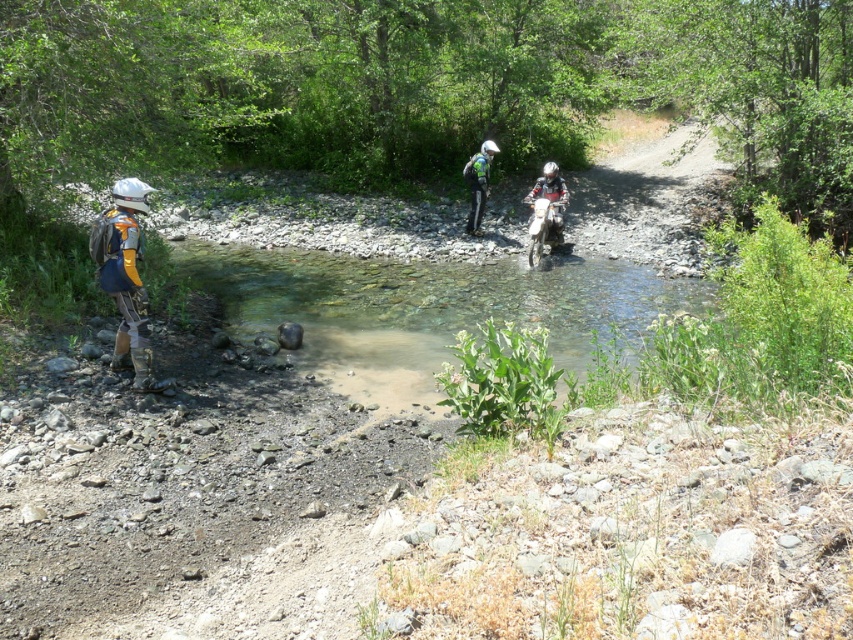
Question: Based on their relative distances, which object is farther from the clear water at center?

Choices:
 (A) matte silver helmet at left
 (B) white matte dirt bike at center
 (C) white matte motorcycle at center
 (D) green matte helmet at center

Answer: (A)

Question: Which of these objects is positioned farthest from the green matte helmet at center?

Choices:
 (A) matte silver helmet at left
 (B) clear water at center
 (C) white matte dirt bike at center

Answer: (A)

Question: Estimate the real-world distances between objects in this image. Which object is closer to the green matte helmet at center?

Choices:
 (A) matte silver helmet at left
 (B) clear water at center
 (C) white matte dirt bike at center
 (D) white matte motorcycle at center

Answer: (D)

Question: Is matte silver helmet at left in front of green matte helmet at center?

Choices:
 (A) no
 (B) yes

Answer: (B)

Question: Can you confirm if clear water at center is smaller than white matte dirt bike at center?

Choices:
 (A) no
 (B) yes

Answer: (A)

Question: Considering the relative positions of white matte dirt bike at center and green matte helmet at center in the image provided, where is white matte dirt bike at center located with respect to green matte helmet at center?

Choices:
 (A) left
 (B) right

Answer: (B)